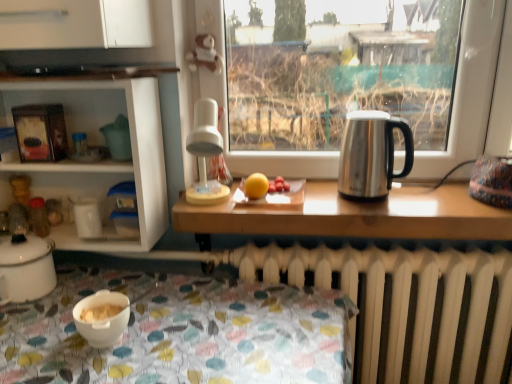
Question: Is white plastic lamp at center directly adjacent to smooth red tomatoes at center?

Choices:
 (A) no
 (B) yes

Answer: (A)

Question: Does white plastic lamp at center have a smaller size compared to smooth red tomatoes at center?

Choices:
 (A) yes
 (B) no

Answer: (B)

Question: Can you confirm if white plastic lamp at center is wider than smooth red tomatoes at center?

Choices:
 (A) no
 (B) yes

Answer: (B)

Question: From the image's perspective, is white plastic lamp at center over smooth red tomatoes at center?

Choices:
 (A) yes
 (B) no

Answer: (A)

Question: Can you confirm if white plastic lamp at center is shorter than smooth red tomatoes at center?

Choices:
 (A) yes
 (B) no

Answer: (B)

Question: Considering the positions of white plastic lamp at center and white enamel pot at lower left in the image, is white plastic lamp at center wider or thinner than white enamel pot at lower left?

Choices:
 (A) thin
 (B) wide

Answer: (B)

Question: Is white plastic lamp at center bigger or smaller than white enamel pot at lower left?

Choices:
 (A) small
 (B) big

Answer: (B)

Question: Considering the positions of point 200,201 and point 39,279, is point 200,201 closer or farther from the camera than point 39,279?

Choices:
 (A) closer
 (B) farther

Answer: (B)

Question: Is white plastic lamp at center situated inside white enamel pot at lower left or outside?

Choices:
 (A) outside
 (B) inside

Answer: (A)

Question: In terms of height, does smooth red tomatoes at center look taller or shorter compared to yellow matte orange at center?

Choices:
 (A) short
 (B) tall

Answer: (A)

Question: From a real-world perspective, is smooth red tomatoes at center physically located above or below yellow matte orange at center?

Choices:
 (A) below
 (B) above

Answer: (A)

Question: Relative to yellow matte orange at center, is smooth red tomatoes at center in front or behind?

Choices:
 (A) front
 (B) behind

Answer: (B)

Question: Visually, is smooth red tomatoes at center positioned to the left or to the right of yellow matte orange at center?

Choices:
 (A) right
 (B) left

Answer: (A)

Question: Considering the positions of point (270, 187) and point (92, 324), is point (270, 187) closer or farther from the camera than point (92, 324)?

Choices:
 (A) closer
 (B) farther

Answer: (B)

Question: From the image's perspective, relative to white matte bowl at lower left, is smooth red tomatoes at center above or below?

Choices:
 (A) below
 (B) above

Answer: (B)